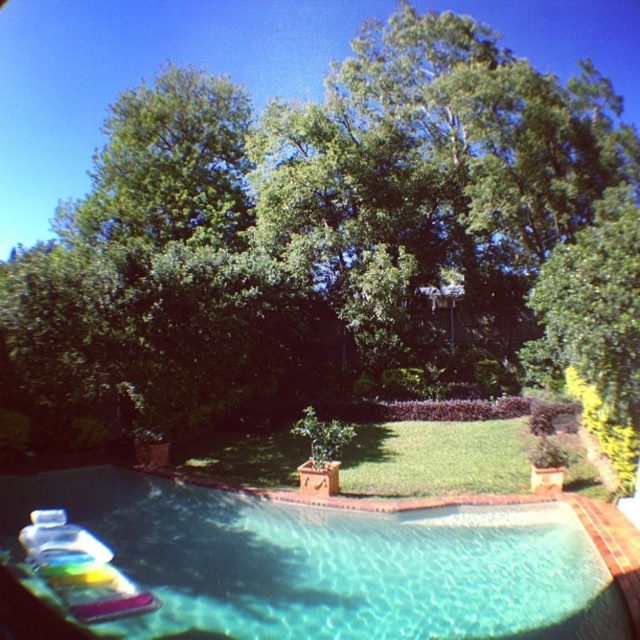
Question: Is green leafy tree at upper center thinner than clear glass pool at lower center?

Choices:
 (A) yes
 (B) no

Answer: (B)

Question: Which point is closer to the camera?

Choices:
 (A) (448, 524)
 (B) (273, 179)

Answer: (A)

Question: Does green leafy tree at upper center appear over clear glass pool at lower center?

Choices:
 (A) no
 (B) yes

Answer: (B)

Question: Where is green leafy tree at upper center located in relation to clear glass pool at lower center in the image?

Choices:
 (A) right
 (B) left

Answer: (B)